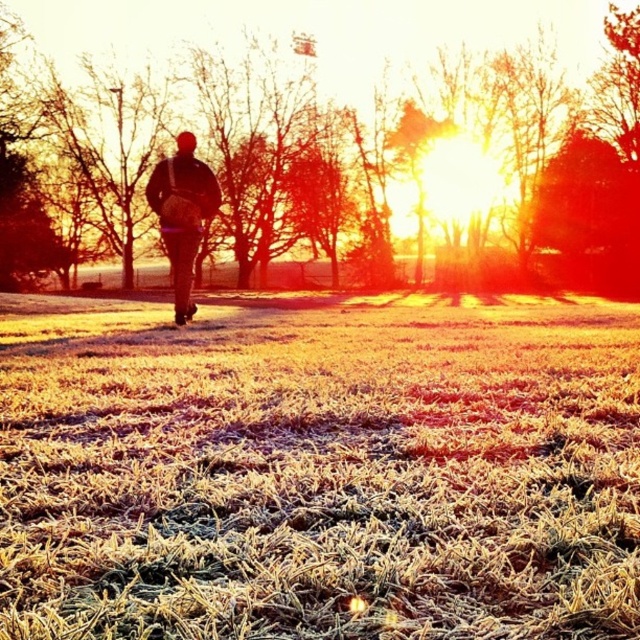
You are planning to take a photo of the frosted grass at center and the matte brown backpack at center. Which object should you focus on first if you want both to be in sharp focus, considering their sizes?

The frosted grass at center is wider than the matte brown backpack at center, so focusing on the wider frosted grass at center first would ensure both are in focus.